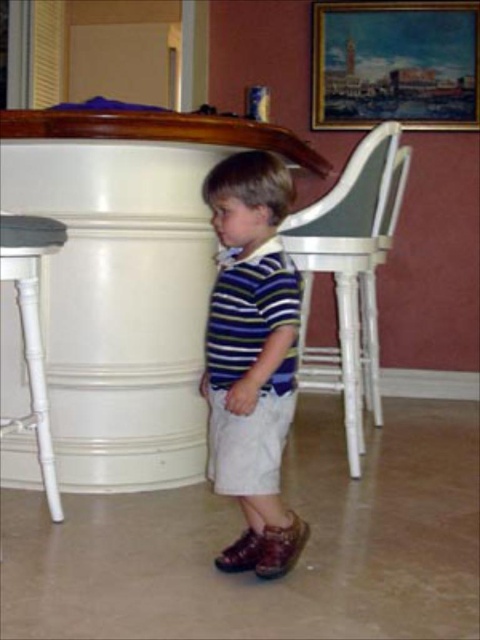
Which is above, oil painting at upper right or white wood chair at center?

oil painting at upper right is higher up.

At what (x,y) coordinates should I click in order to perform the action: click on oil painting at upper right. Please return your answer as a coordinate pair (x, y). The width and height of the screenshot is (480, 640). Looking at the image, I should click on (395, 65).

The height and width of the screenshot is (640, 480). What are the coordinates of `oil painting at upper right` in the screenshot? It's located at (395, 65).

Can you confirm if white glossy table at left is taller than white wood chair at center?

In fact, white glossy table at left may be shorter than white wood chair at center.

Who is positioned more to the left, white glossy table at left or white wood chair at center?

Positioned to the left is white glossy table at left.

Where is `white glossy table at left`? white glossy table at left is located at coordinates (127, 280).

Find the location of a particular element. This screenshot has width=480, height=640. white wood chair at center is located at coordinates (346, 280).

Can you confirm if white wood chair at center is wider than white wood bar stool at left?

Indeed, white wood chair at center has a greater width compared to white wood bar stool at left.

Who is more distant from viewer, (312,372) or (34,376)?

The point (312,372) is more distant.

Where is `white wood chair at center`? This screenshot has height=640, width=480. white wood chair at center is located at coordinates (346, 280).